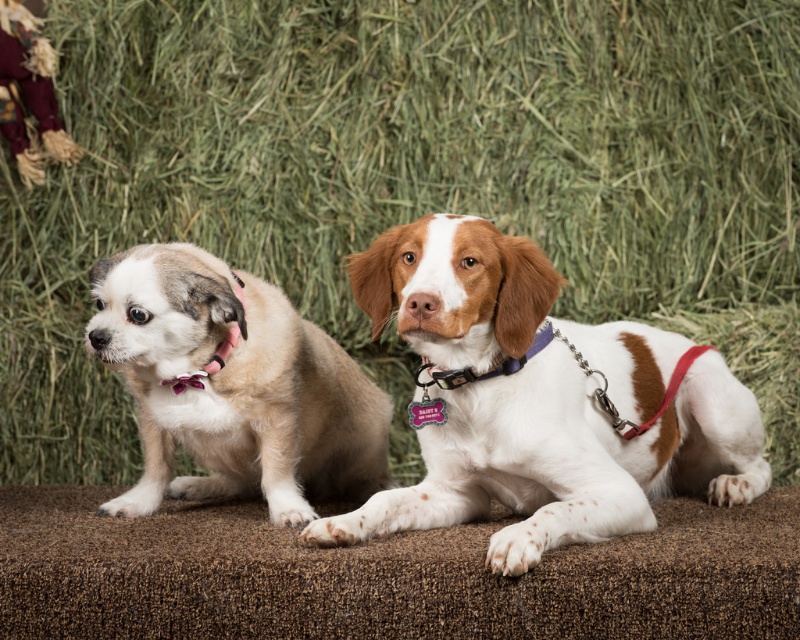
Does brown and white fur at center appear on the left side of light brown fur at left?

Incorrect, brown and white fur at center is not on the left side of light brown fur at left.

Between brown and white fur at center and light brown fur at left, which one has more height?

brown and white fur at center is taller.

Does point (448, 269) come closer to viewer compared to point (289, 413)?

Yes, point (448, 269) is closer to viewer.

Image resolution: width=800 pixels, height=640 pixels. I want to click on brown and white fur at center, so click(540, 401).